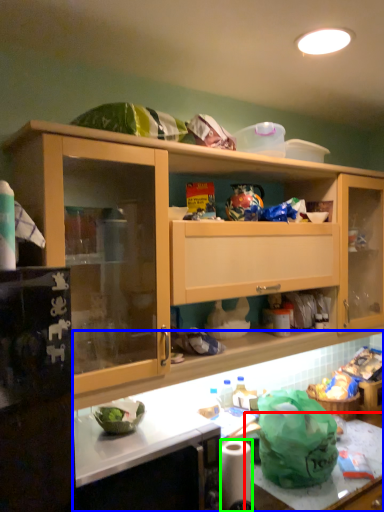
Question: Based on their relative distances, which object is nearer to counter top (highlighted by a red box)? Choose from countertop (highlighted by a blue box) and toilet paper (highlighted by a green box).

Choices:
 (A) countertop
 (B) toilet paper

Answer: (B)